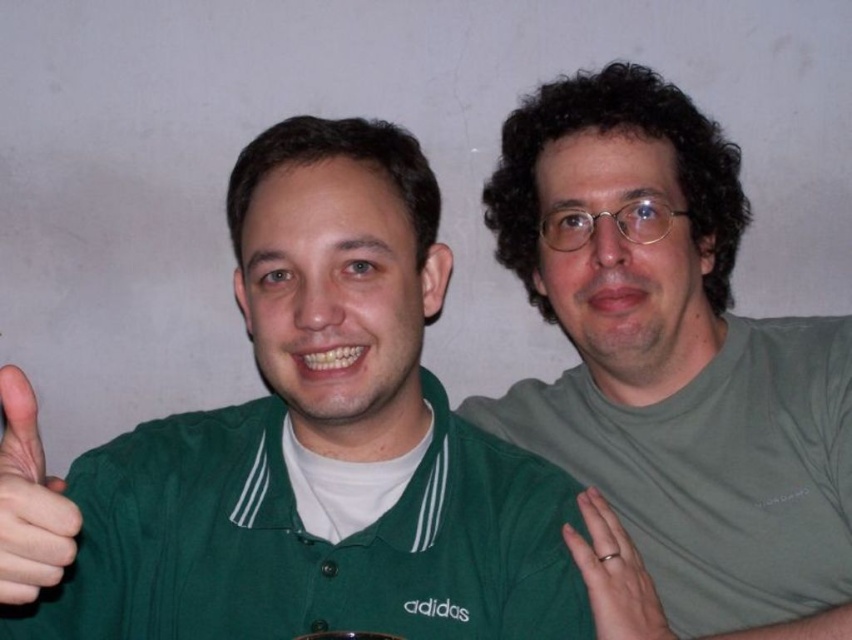
You are an AI analyzing a photo of two people standing side by side. The scene has a plain light wall in the background. You need to determine the exact 2D coordinates of the green matte shirt at upper right. What are its coordinates?

The green matte shirt at upper right is located at the 2D coordinates of point (x=671, y=372).

You are a photographer adjusting the lighting for a portrait. You notice the green fabric hand at left and the silver metallic ring at right in the frame. Which object should you focus on first to ensure proper exposure, considering their position?

The green fabric hand at left should be focused on first because it is in front of the silver metallic ring at right, making it the primary subject closer to the camera.

You are trying to determine if the green matte shirt at upper right can completely cover the green fabric hand at left when placed over it. Based on their sizes, is this possible?

The green matte shirt at upper right is bigger than the green fabric hand at left, so yes, it can completely cover the green fabric hand at left when placed over it.